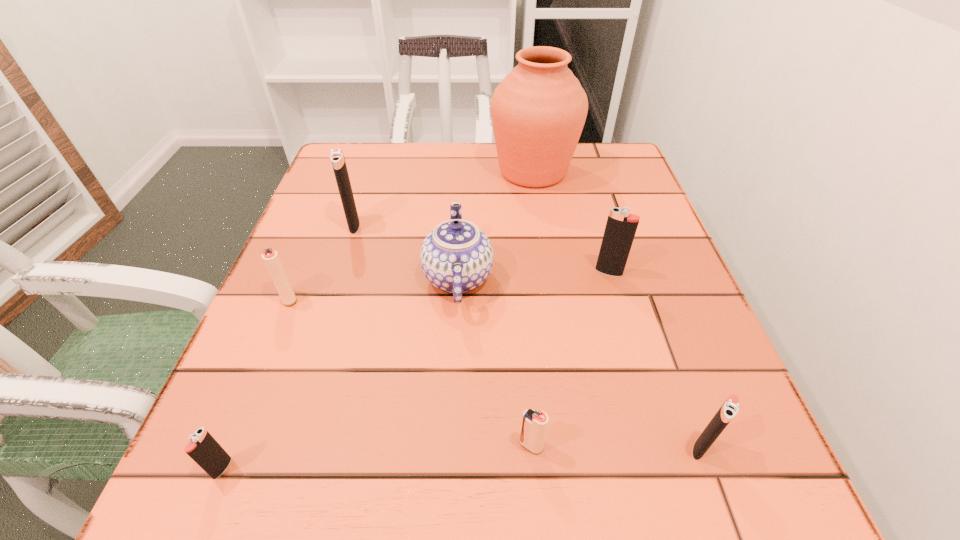
What are the coordinates of `vacant space that satisfies the following two spatial constraints: 1. on the front side of the bigger red igniter; 2. on the right side of the rightmost igniter` in the screenshot? It's located at (228, 448).

This screenshot has width=960, height=540. I want to click on free location that satisfies the following two spatial constraints: 1. on the back side of the biggest black igniter; 2. on the left side of the third farthest igniter, so click(x=319, y=226).

I want to click on vacant space that satisfies the following two spatial constraints: 1. on the back side of the farther red igniter; 2. on the right side of the third black igniter from left to right, so click(300, 272).